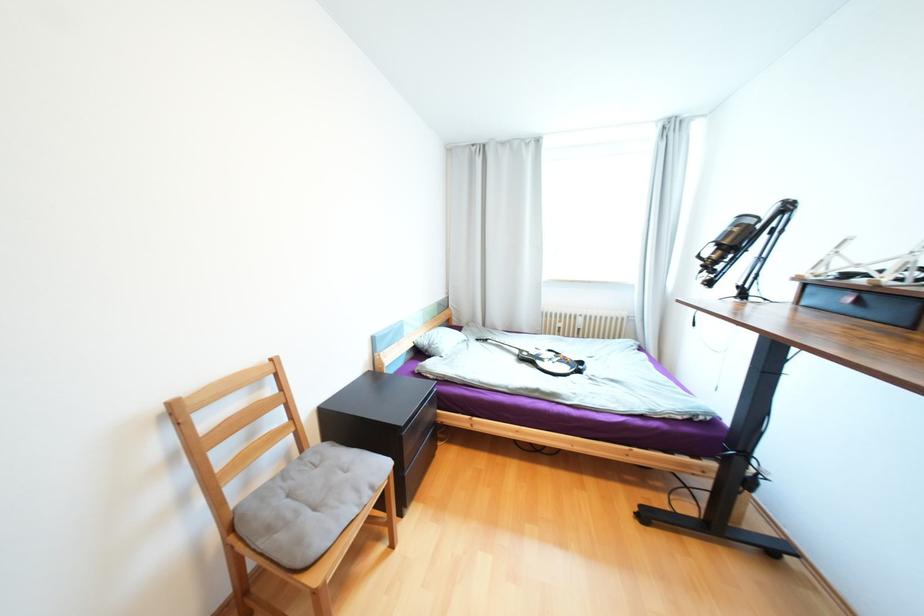
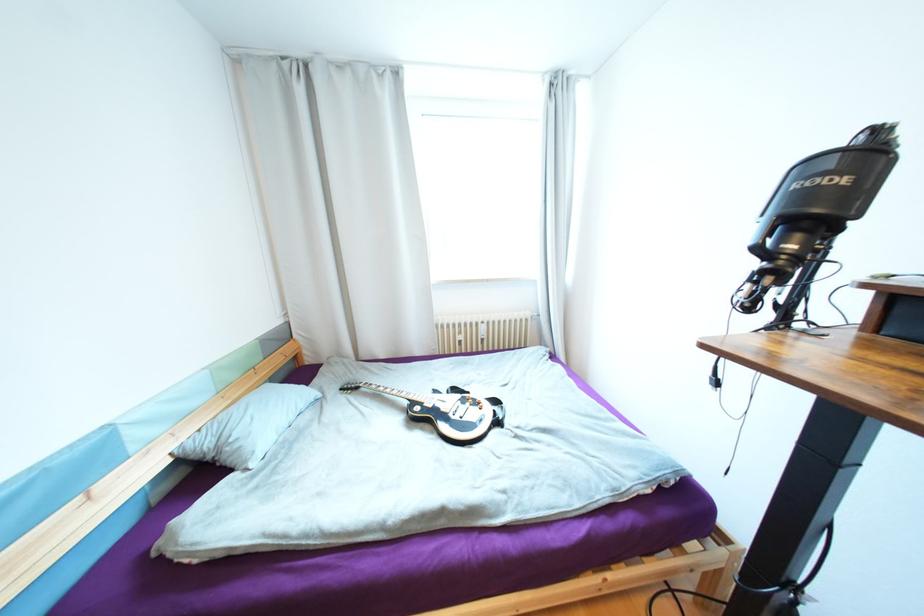
Question: How did the camera likely rotate?

Choices:
 (A) Left
 (B) Right
 (C) Up
 (D) Down

Answer: (B)